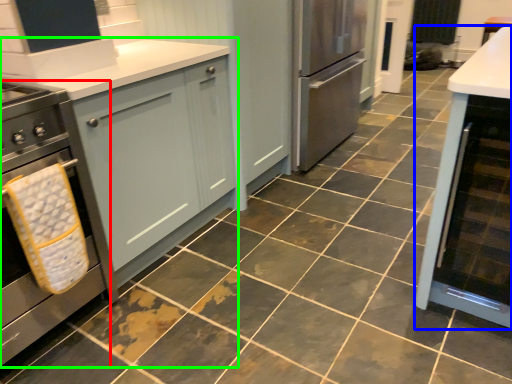
Question: Which is farther away from home appliance (highlighted by a red box)? cabinetry (highlighted by a blue box) or cabinetry (highlighted by a green box)?

Choices:
 (A) cabinetry
 (B) cabinetry

Answer: (A)